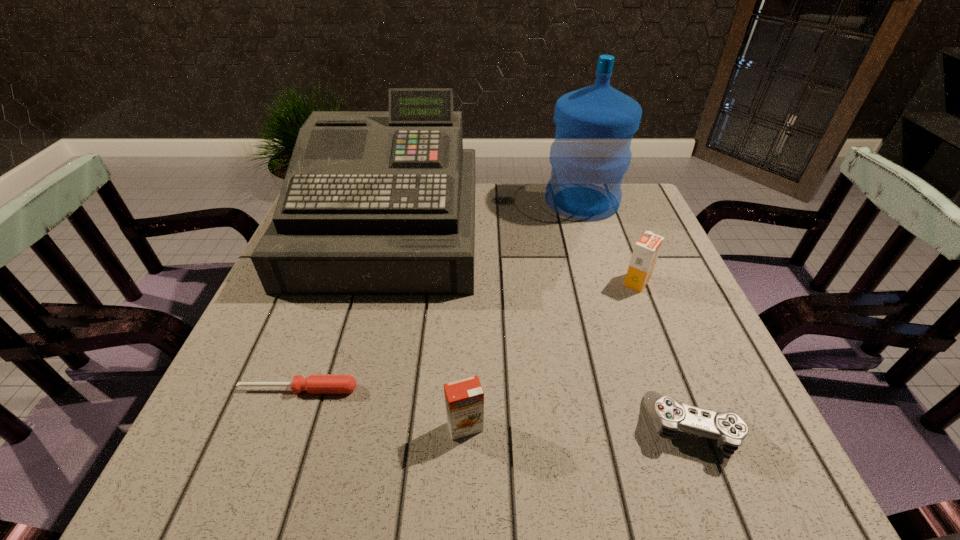
I want to click on blank space that satisfies the following two spatial constraints: 1. on the front-facing side of the fifth shortest object; 2. on the left side of the right orange juice, so click(373, 282).

At what (x,y) coordinates should I click in order to perform the action: click on free space that satisfies the following two spatial constraints: 1. on the front side of the control; 2. on the left side of the shortest object. Please return your answer as a coordinate pair (x, y). Looking at the image, I should click on (285, 427).

Find the location of a particular element. This screenshot has width=960, height=540. vacant region that satisfies the following two spatial constraints: 1. on the front-facing side of the farther orange juice; 2. on the left side of the fifth shortest object is located at coordinates (373, 282).

Find the location of a particular element. The width and height of the screenshot is (960, 540). free location that satisfies the following two spatial constraints: 1. on the back side of the tallest object; 2. on the left side of the nearer orange juice is located at coordinates (471, 201).